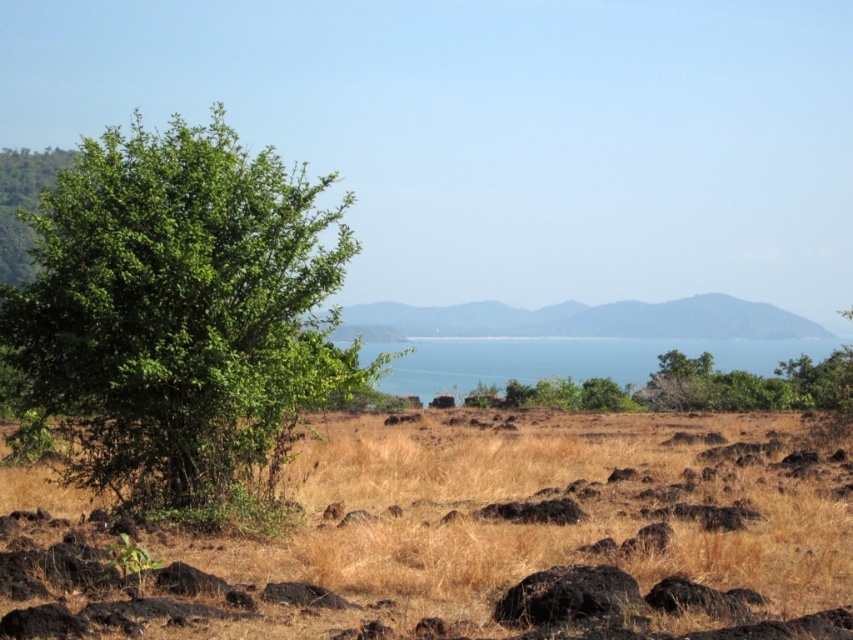
You are standing at the center of the image and want to place a small weather station. The weather station requires a clear, open space away from any rocks or vegetation. Based on the scene, is the brown dry grass at center a suitable location for the weather station?

The brown dry grass at center is located at point (465,540), which is the center of the image. Since there are no rocks or vegetation mentioned near this specific location in the scene description, it could be a suitable spot for the weather station. However, ensure there are no hidden obstacles not described here.

Consider the image. You are standing in a landscape with dry grass and rocks. You want to take a photo of the brown dry grass at center from a distance of 8 meters. Can you do it?

The brown dry grass at center is 7.97 meters away from camera, so yes, you can take the photo from 8 meters away as the distance is sufficient.

You are standing in the landscape and want to take a photo of the green leafy tree at left. However, the brown dry grass at center is blocking your view. Can you move to the right to get a clear shot without the grass in the way?

The brown dry grass at center is in front of the green leafy tree at left, so moving to the right might not help because the grass is between you and the tree. You need to move around or behind the grass to get a clear view.